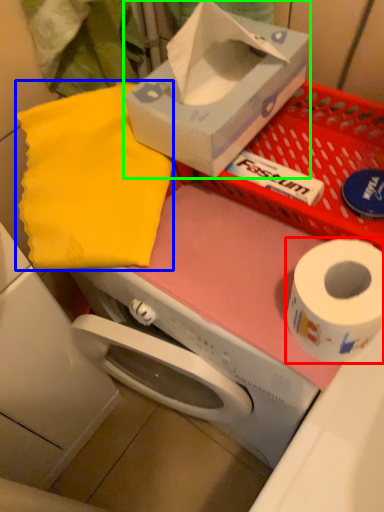
Question: Considering the real-world distances, which object is farthest from toilet paper (highlighted by a red box)? cloth (highlighted by a blue box) or box (highlighted by a green box)?

Choices:
 (A) cloth
 (B) box

Answer: (A)